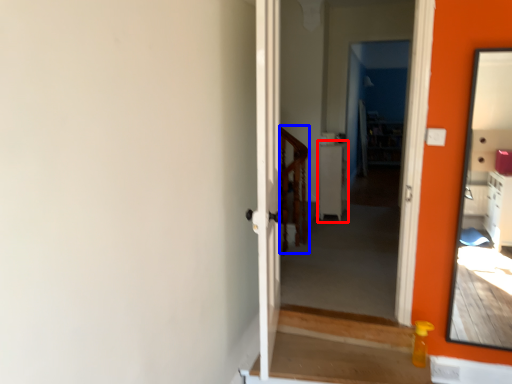
Question: Which point is closer to the camera, table (highlighted by a red box) or balustrade (highlighted by a blue box)?

Choices:
 (A) table
 (B) balustrade

Answer: (B)